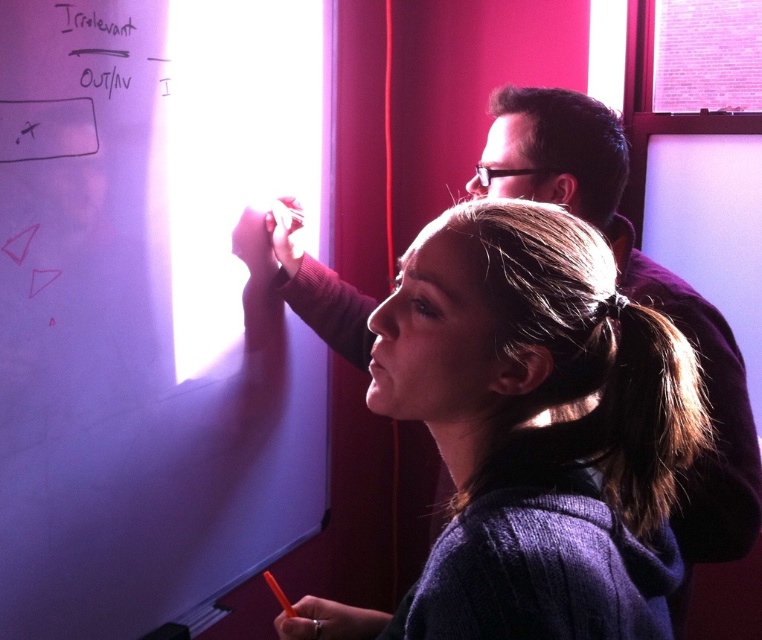
Question: Which of the following is the closest to the observer?

Choices:
 (A) purple sweater at center
 (B) white matte board at upper left
 (C) white paper at upper left

Answer: (A)

Question: Is white matte board at upper left further to the viewer compared to purple sweater at center?

Choices:
 (A) yes
 (B) no

Answer: (A)

Question: Does white matte board at upper left have a larger size compared to white paper at upper left?

Choices:
 (A) yes
 (B) no

Answer: (A)

Question: Which point is closer to the camera?

Choices:
 (A) (59, 10)
 (B) (203, 458)

Answer: (A)

Question: Can you confirm if white matte board at upper left is smaller than white paper at upper left?

Choices:
 (A) yes
 (B) no

Answer: (B)

Question: Among these points, which one is nearest to the camera?

Choices:
 (A) (514, 452)
 (B) (165, 90)

Answer: (A)